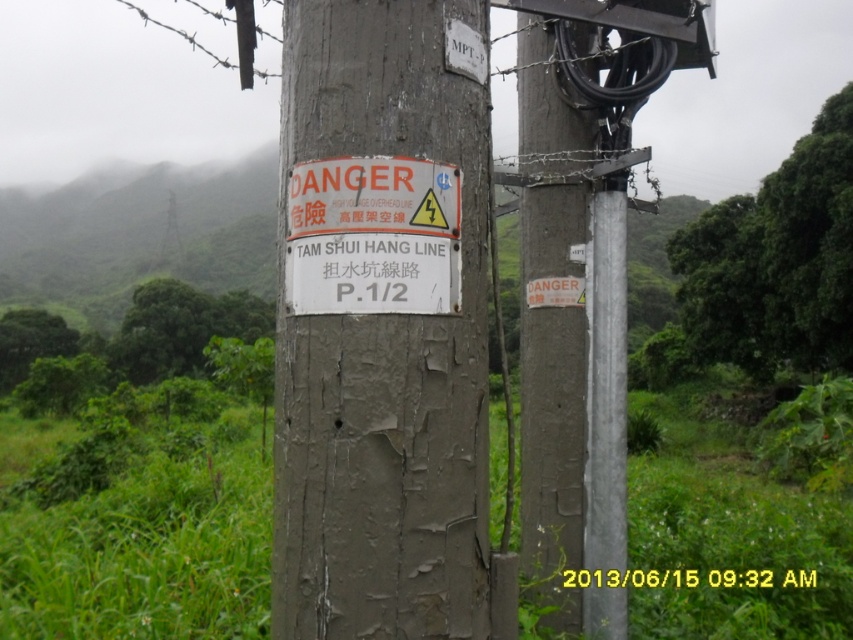
Image resolution: width=853 pixels, height=640 pixels. What do you see at coordinates (552, 394) in the screenshot?
I see `weathered wood post at right` at bounding box center [552, 394].

Where is `weathered wood post at right`? The width and height of the screenshot is (853, 640). weathered wood post at right is located at coordinates (552, 394).

Locate an element on the screen. weathered wood post at right is located at coordinates (552, 394).

Who is positioned more to the right, gray weathered wood post at center or weathered wood post at right?

weathered wood post at right

Is gray weathered wood post at center taller than weathered wood post at right?

In fact, gray weathered wood post at center may be shorter than weathered wood post at right.

Does point (289, 333) come farther from viewer compared to point (550, 72)?

No.

Where is `gray weathered wood post at center`? gray weathered wood post at center is located at coordinates (384, 348).

Does gray weathered wood post at center have a lesser width compared to white paper sign at center?

Incorrect, gray weathered wood post at center's width is not less than white paper sign at center's.

How much distance is there between gray weathered wood post at center and white paper sign at center?

gray weathered wood post at center is 5.02 inches from white paper sign at center.

Describe the element at coordinates (384, 348) in the screenshot. I see `gray weathered wood post at center` at that location.

I want to click on gray weathered wood post at center, so click(x=384, y=348).